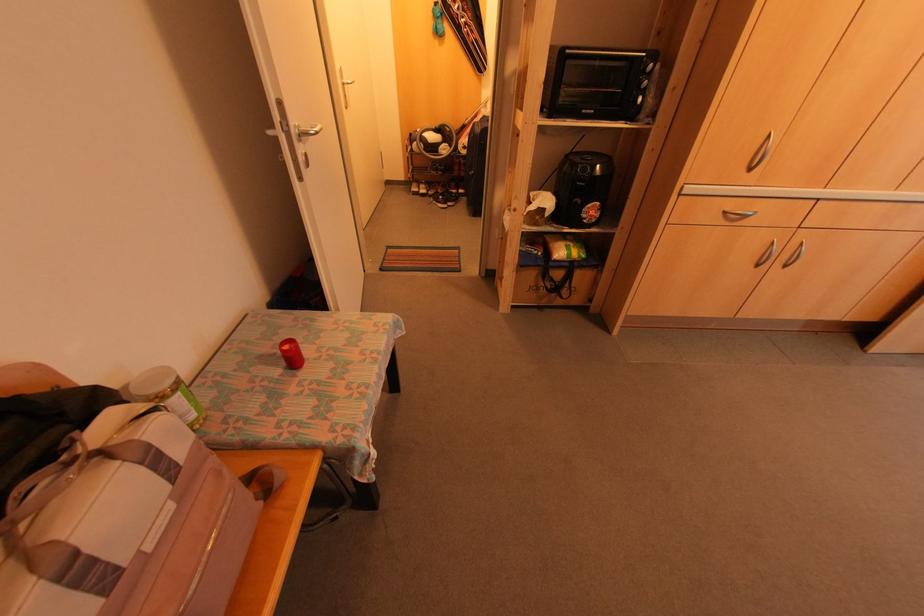
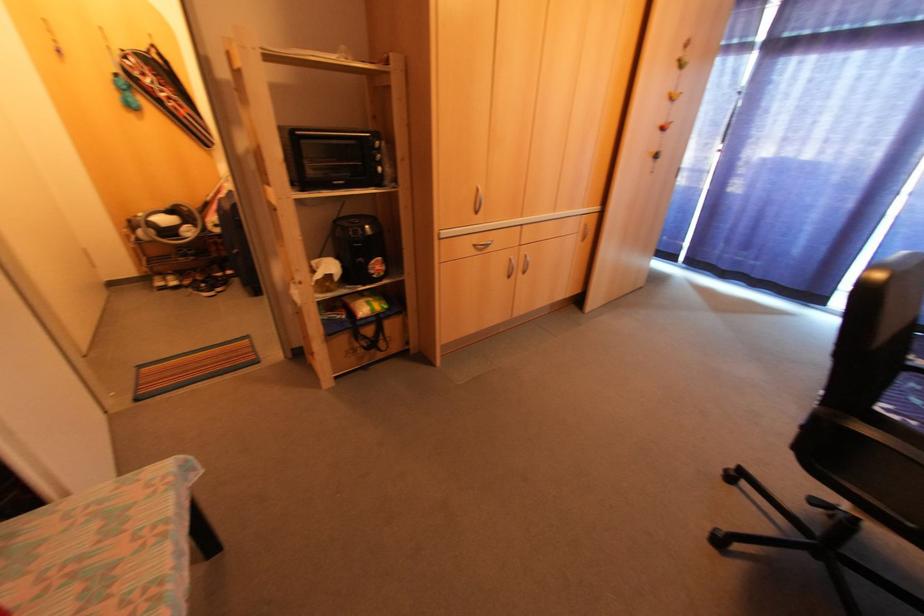
Locate, in the second image, the point that corresponds to point 580,111 in the first image.

(334, 184)